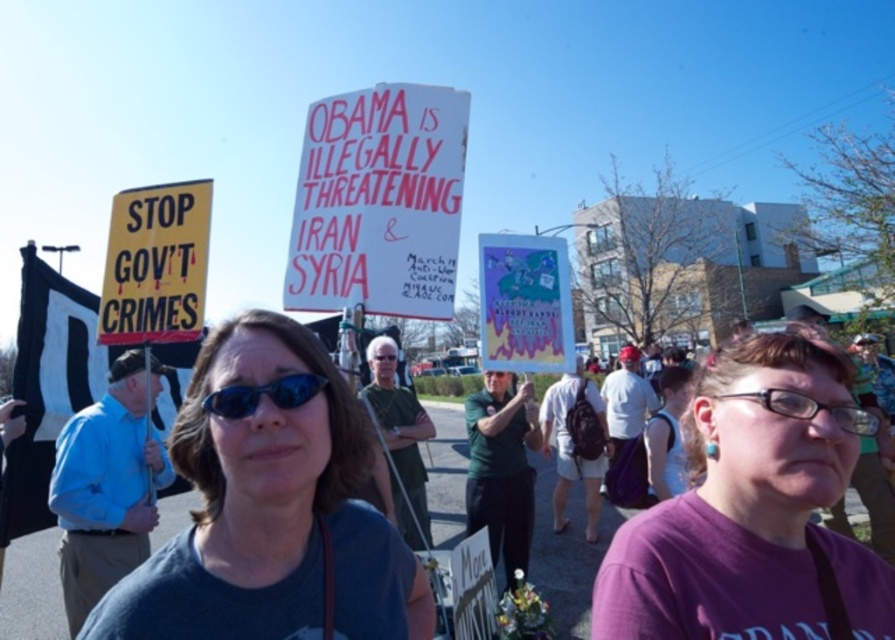
Question: Is pink paper sign at center thinner than yellow paper sign at left?

Choices:
 (A) no
 (B) yes

Answer: (A)

Question: Which object is the closest to the sunglasses at center?

Choices:
 (A) transparent plastic glasses at center
 (B) yellow paper sign at left
 (C) gray fabric shirt at center

Answer: (C)

Question: Which of these objects is positioned farthest from the purple fabric shirt at center?

Choices:
 (A) gray fabric shirt at center
 (B) transparent plastic glasses at center

Answer: (A)

Question: Among these objects, which one is nearest to the camera?

Choices:
 (A) gray fabric shirt at center
 (B) purple fabric shirt at center
 (C) transparent plastic glasses at center
 (D) yellow paper sign at left

Answer: (A)

Question: Does purple fabric shirt at center appear on the right side of pink paper sign at center?

Choices:
 (A) no
 (B) yes

Answer: (B)

Question: Does yellow paper sign at left appear on the left side of sunglasses at center?

Choices:
 (A) no
 (B) yes

Answer: (B)